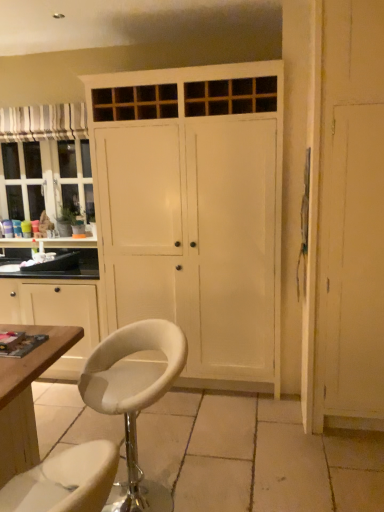
You are a GUI agent. You are given a task and a screenshot of the screen. Output one action in this format:
    pyautogui.click(x=<x>, y=<y>)
    Task: Click on the free spot below striped fabric curtain at upper left (from a real-world perspective)
    The image size is (384, 512).
    Given the screenshot: What is the action you would take?
    pyautogui.click(x=51, y=249)